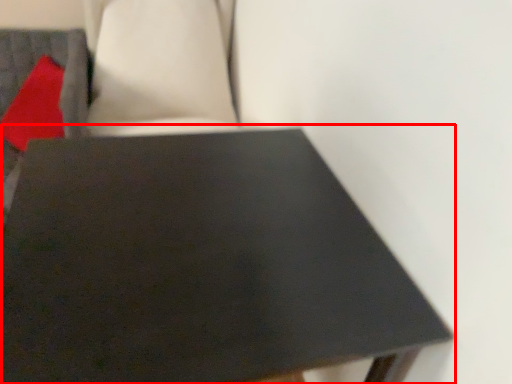
Question: From the image's perspective, considering the relative positions of table (annotated by the red box) and pillow in the image provided, where is table (annotated by the red box) located with respect to the staircase?

Choices:
 (A) above
 (B) below

Answer: (B)